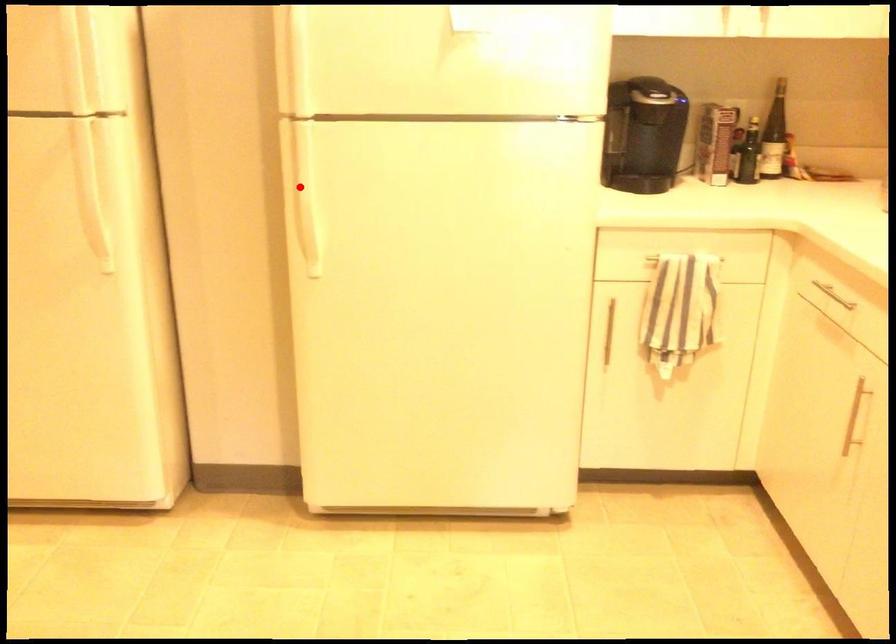
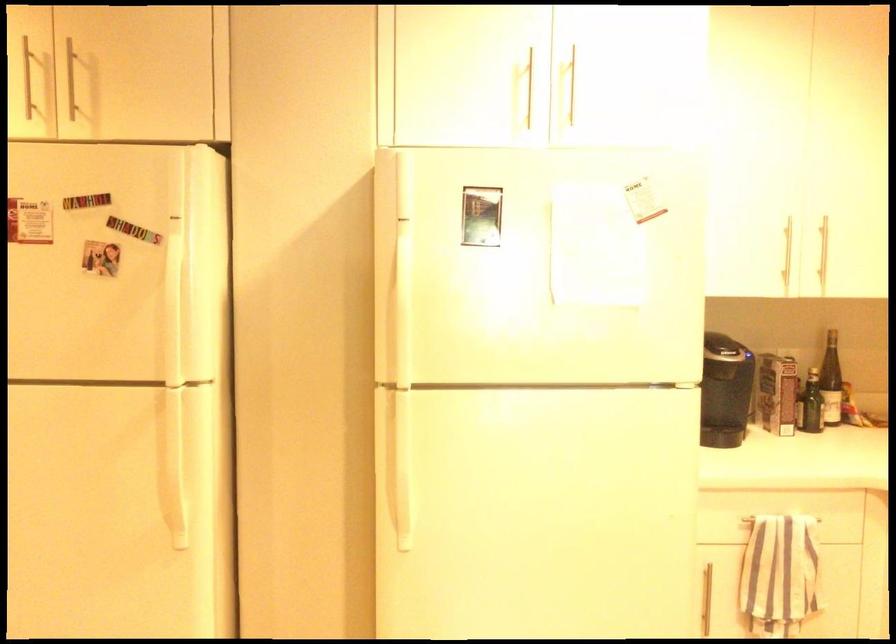
The point at the highlighted location is marked in the first image. Where is the corresponding point in the second image?

(398, 460)